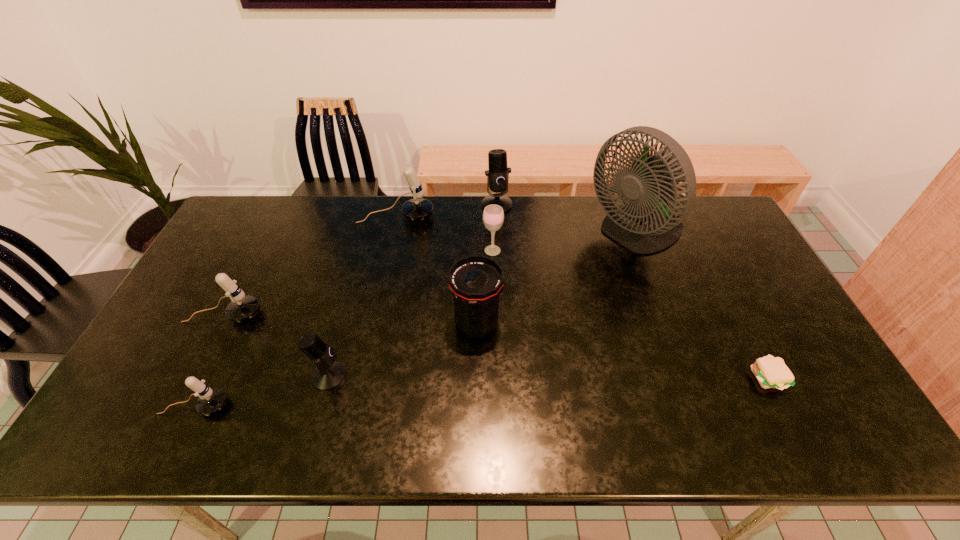
At what (x,y) coordinates should I click in order to perform the action: click on vacant position at the far edge of the desktop. Please return your answer as a coordinate pair (x, y). Looking at the image, I should click on (376, 219).

At what (x,y) coordinates should I click in order to perform the action: click on blank space at the near edge of the desktop. Please return your answer as a coordinate pair (x, y). Image resolution: width=960 pixels, height=540 pixels. Looking at the image, I should click on (596, 436).

In order to click on blank space at the left edge in this screenshot , I will do `click(241, 287)`.

Identify the location of free space at the right edge of the desktop. The width and height of the screenshot is (960, 540). (800, 356).

You are a GUI agent. You are given a task and a screenshot of the screen. Output one action in this format:
    pyautogui.click(x=<x>, y=<y>)
    Task: Click on the vacant point at the far left corner
    Image resolution: width=960 pixels, height=540 pixels.
    Given the screenshot: What is the action you would take?
    pyautogui.click(x=254, y=200)

Identify the location of vacant region at the far right corner of the desktop. (697, 226).

At what (x,y) coordinates should I click in order to perform the action: click on free space between the farther black microphone and the shortest microphone. Please return your answer as a coordinate pair (x, y). The width and height of the screenshot is (960, 540). Looking at the image, I should click on (346, 306).

Locate an element on the screen. vacant area that lies between the wineglass and the shortest object is located at coordinates (630, 314).

Image resolution: width=960 pixels, height=540 pixels. Find the location of `unoccupied area between the right black microphone and the biggest white microphone`. unoccupied area between the right black microphone and the biggest white microphone is located at coordinates (446, 211).

At what (x,y) coordinates should I click in order to perform the action: click on vacant area that lies between the fan and the farthest white microphone. Please return your answer as a coordinate pair (x, y). The image size is (960, 540). Looking at the image, I should click on (516, 225).